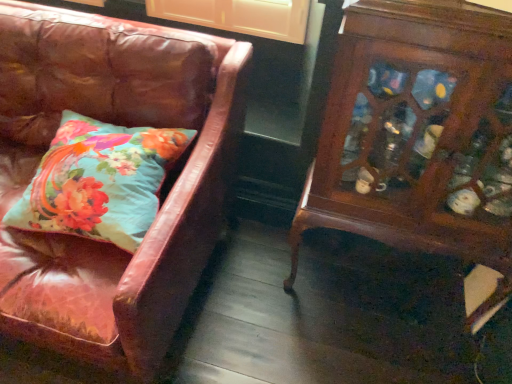
Question: In the image, is teal floral pillow at left on the left side or the right side of wooden cabinet at right?

Choices:
 (A) left
 (B) right

Answer: (A)

Question: Considering the positions of teal floral pillow at left and wooden cabinet at right in the image, is teal floral pillow at left wider or thinner than wooden cabinet at right?

Choices:
 (A) wide
 (B) thin

Answer: (A)

Question: Which of these objects is positioned closest to the wooden cabinet at right?

Choices:
 (A) leather couch at left
 (B) teal floral pillow at left

Answer: (A)

Question: Which object is positioned farthest from the teal floral pillow at left?

Choices:
 (A) wooden cabinet at right
 (B) leather couch at left

Answer: (A)